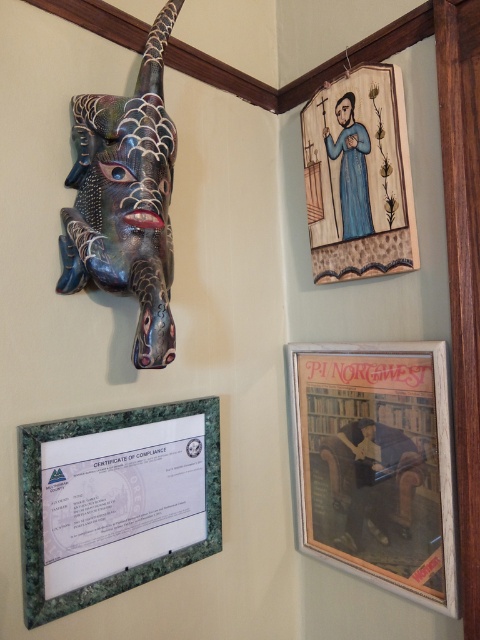
Question: In this image, where is wooden framed poster at lower right located relative to green marble certificate at lower left?

Choices:
 (A) right
 (B) left

Answer: (A)

Question: Estimate the real-world distances between objects in this image. Which object is closer to the wooden framed poster at lower right?

Choices:
 (A) wooden painted figure at upper right
 (B) metallic textured mask at upper left
 (C) green marble certificate at lower left

Answer: (C)

Question: Considering the relative positions of green marble certificate at lower left and metallic textured mask at upper left in the image provided, where is green marble certificate at lower left located with respect to metallic textured mask at upper left?

Choices:
 (A) below
 (B) above

Answer: (A)

Question: Can you confirm if metallic textured mask at upper left is thinner than wooden painted figure at upper right?

Choices:
 (A) yes
 (B) no

Answer: (B)

Question: Estimate the real-world distances between objects in this image. Which object is closer to the wooden painted figure at upper right?

Choices:
 (A) metallic textured mask at upper left
 (B) wooden framed poster at lower right
 (C) green marble certificate at lower left

Answer: (B)

Question: Which point is farther to the camera?

Choices:
 (A) (70, 285)
 (B) (75, 456)
 (C) (375, 177)

Answer: (C)